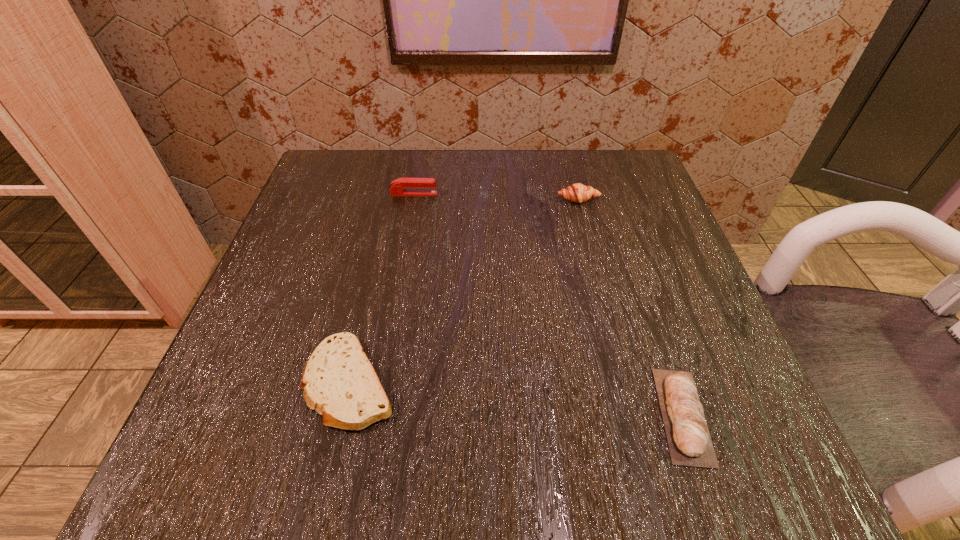
You are a GUI agent. You are given a task and a screenshot of the screen. Output one action in this format:
    pyautogui.click(x=<x>, y=<y>)
    Task: Click on the blank area in the image that satisfies the following two spatial constraints: 1. on the back side of the taller pita bread; 2. on the front-facing side of the stapler
    The width and height of the screenshot is (960, 540).
    Given the screenshot: What is the action you would take?
    pyautogui.click(x=608, y=194)

The height and width of the screenshot is (540, 960). Identify the location of free space in the image that satisfies the following two spatial constraints: 1. on the front side of the right pita bread; 2. on the right side of the left pita bread. (343, 415).

This screenshot has width=960, height=540. What are the coordinates of `free spot that satisfies the following two spatial constraints: 1. on the front-facing side of the taller pita bread; 2. on the right side of the pastry` in the screenshot? It's located at (635, 415).

Identify the location of vacant space that satisfies the following two spatial constraints: 1. on the front-facing side of the right pita bread; 2. on the right side of the pastry. This screenshot has height=540, width=960. (635, 415).

Where is `free space that satisfies the following two spatial constraints: 1. on the front-facing side of the pastry; 2. on the left side of the taller pita bread`? free space that satisfies the following two spatial constraints: 1. on the front-facing side of the pastry; 2. on the left side of the taller pita bread is located at coordinates (635, 415).

Identify the location of free space that satisfies the following two spatial constraints: 1. on the front-facing side of the stapler; 2. on the right side of the right pita bread. The width and height of the screenshot is (960, 540). (375, 415).